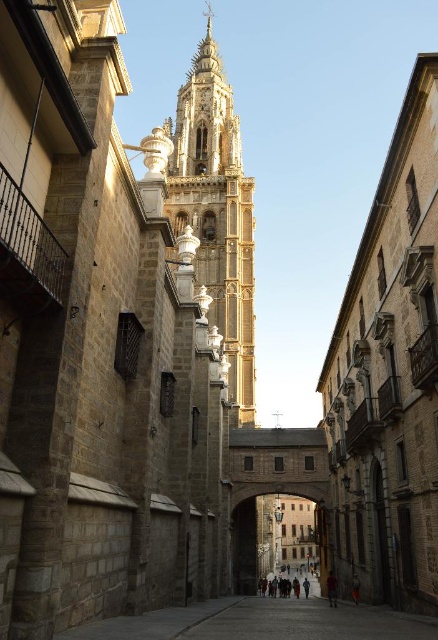
Question: Among these points, which one is farthest from the camera?

Choices:
 (A) (228, 324)
 (B) (286, 580)

Answer: (B)

Question: Estimate the real-world distances between objects in this image. Which object is farther from the smooth stone church at center?

Choices:
 (A) golden stone tower at center
 (B) dark red fabric at center
 (C) dark gray stone people at center

Answer: (A)

Question: Considering the real-world distances, which object is closest to the golden stone tower at center?

Choices:
 (A) dark gray stone people at center
 (B) dark red fabric at center
 (C) smooth stone church at center

Answer: (C)

Question: Can you confirm if golden stone tower at center is positioned above dark red fabric at center?

Choices:
 (A) yes
 (B) no

Answer: (A)

Question: Does smooth stone church at center appear on the left side of dark gray stone people at center?

Choices:
 (A) no
 (B) yes

Answer: (A)

Question: Considering the relative positions of golden stone tower at center and dark gray stone people at center in the image provided, where is golden stone tower at center located with respect to dark gray stone people at center?

Choices:
 (A) above
 (B) below

Answer: (A)